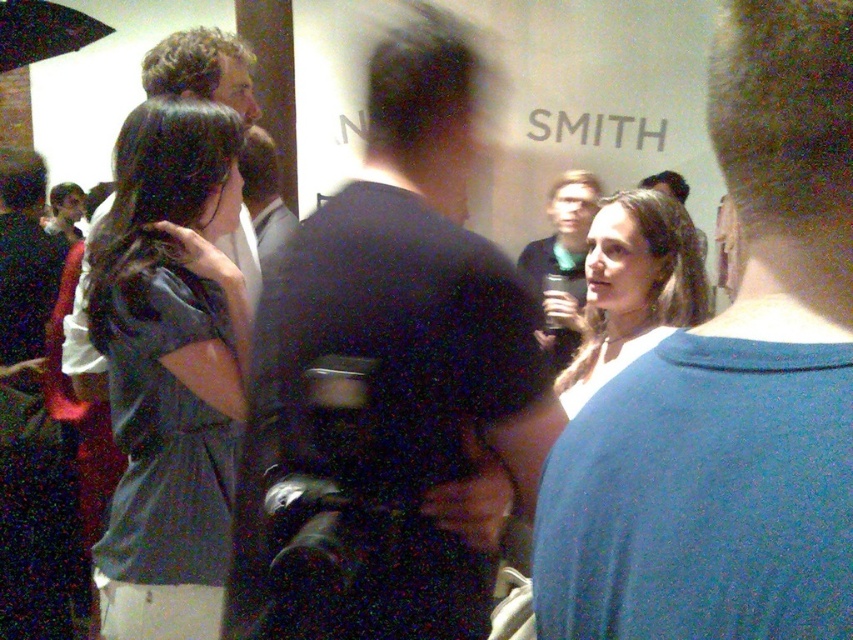
Question: Based on their relative distances, which object is nearer to the matte blue shirt at center?

Choices:
 (A) matte gray shirt at left
 (B) matte black jacket at center
 (C) black leather jacket at center

Answer: (B)

Question: Can you confirm if blue cotton t-shirt at upper right is bigger than matte gray suit at center?

Choices:
 (A) yes
 (B) no

Answer: (B)

Question: Which point appears farthest from the camera in this image?

Choices:
 (A) (126, 228)
 (B) (791, 193)

Answer: (A)

Question: Observing the image, what is the correct spatial positioning of black leather jacket at center in reference to matte gray suit at center?

Choices:
 (A) right
 (B) left

Answer: (A)

Question: Does matte blue shirt at center have a greater width compared to matte gray suit at center?

Choices:
 (A) yes
 (B) no

Answer: (A)

Question: Which is nearer to the matte blue shirt at center?

Choices:
 (A) matte black jacket at center
 (B) matte gray shirt at left
 (C) blue cotton t-shirt at upper right
 (D) matte gray suit at center

Answer: (A)